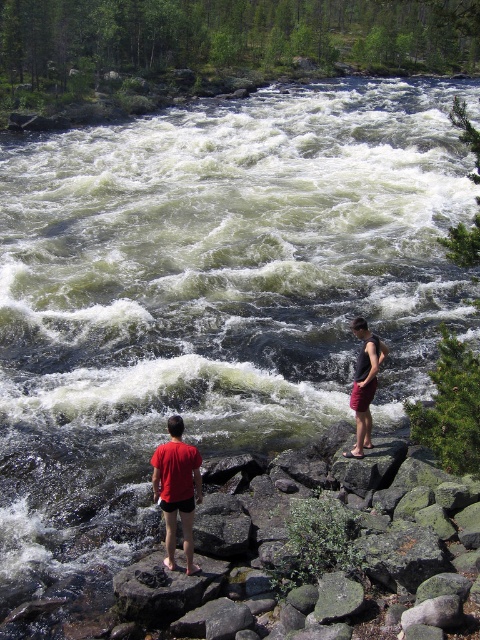
You are a photographer planning to take a photo of the river scene. You want to ensure both the matte red shorts at lower left and the red fabric shorts at center are clearly visible. Which of the two should you focus on first to ensure depth of field captures both?

The matte red shorts at lower left is below the red fabric shorts at center, so focusing on the red fabric shorts at center first would help ensure both are in focus due to its closer proximity to the background.

You are standing at the riverbank and want to reach the point marked as point (190, 506). Given that the river has strong currents and the path is rocky, can you safely walk to that point if you can only move 20 feet?

The distance between you and point (190, 506) is 25.05 feet, which exceeds your 20 feet movement limit. Therefore, you cannot safely walk to that point.

You are a photographer trying to capture both the matte red shorts at lower left and the dark gray tank top at center in a single frame. Which object should you focus on first to ensure both are in the frame?

You should focus on the dark gray tank top at center first because the matte red shorts at lower left is shorter than it, so adjusting the frame to include the taller object will naturally include the shorter one.